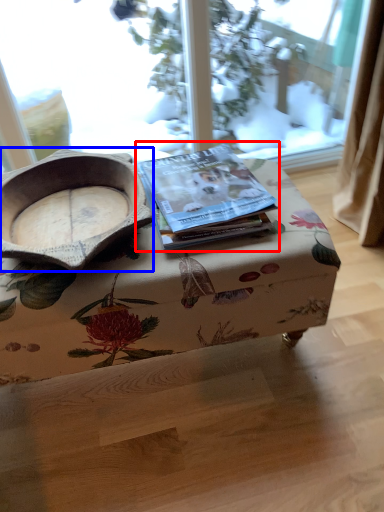
Question: Among these objects, which one is nearest to the camera, paperback book (highlighted by a red box) or bowl (highlighted by a blue box)?

Choices:
 (A) paperback book
 (B) bowl

Answer: (B)